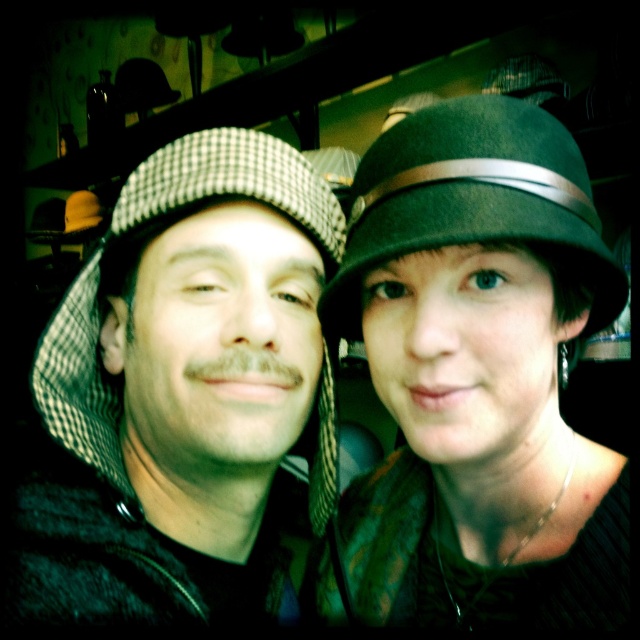
Question: Does green felt hat at upper center appear under green felt fedora at center?

Choices:
 (A) yes
 (B) no

Answer: (A)

Question: Among these points, which one is farthest from the camera?

Choices:
 (A) (541, 483)
 (B) (464, 177)
 (C) (92, 593)

Answer: (A)

Question: Which point is closer to the camera?

Choices:
 (A) (100, 385)
 (B) (465, 568)

Answer: (B)

Question: Estimate the real-world distances between objects in this image. Which object is closer to the green felt fedora at center?

Choices:
 (A) green felt hat at upper center
 (B) checkered fabric hat at left

Answer: (A)

Question: Is checkered fabric hat at left behind green felt fedora at center?

Choices:
 (A) no
 (B) yes

Answer: (B)

Question: Does green felt hat at upper center have a larger size compared to green felt fedora at center?

Choices:
 (A) yes
 (B) no

Answer: (A)